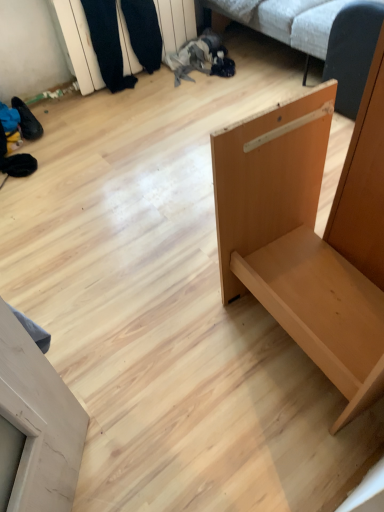
Describe the element at coordinates (299, 23) in the screenshot. The height and width of the screenshot is (512, 384). I see `white fabric couch at upper center` at that location.

Find the location of a particular element. This screenshot has width=384, height=512. light brown wood shelf at right, the 1th furniture from the right is located at coordinates (309, 234).

Image resolution: width=384 pixels, height=512 pixels. Describe the element at coordinates (309, 234) in the screenshot. I see `light brown wood shelf at right, the 1th furniture from the right` at that location.

Describe the element at coordinates (35, 426) in the screenshot. I see `light brown wood door at lower left, which is counted as the first furniture, starting from the left` at that location.

This screenshot has height=512, width=384. I want to click on light brown wood door at lower left, which is counted as the first furniture, starting from the left, so click(x=35, y=426).

Describe the element at coordinates (78, 44) in the screenshot. The image size is (384, 512). I see `wooden shelf at upper left` at that location.

At what (x,y) coordinates should I click in order to perform the action: click on white fabric couch at upper center. Please return your answer as a coordinate pair (x, y). The width and height of the screenshot is (384, 512). Looking at the image, I should click on (299, 23).

Choose the correct answer: Is light brown wood shelf at right, which is the 2th furniture from left to right, inside light brown wood door at lower left, which is counted as the first furniture, starting from the left, or outside it?

light brown wood shelf at right, which is the 2th furniture from left to right, is not enclosed by light brown wood door at lower left, which is counted as the first furniture, starting from the left.

Can you confirm if light brown wood shelf at right, which is the 2th furniture from left to right, is thinner than light brown wood door at lower left, acting as the 2th furniture starting from the right?

No.

Are light brown wood shelf at right, which is the 2th furniture from left to right, and light brown wood door at lower left, acting as the 2th furniture starting from the right, located far from each other?

That's not correct — light brown wood shelf at right, which is the 2th furniture from left to right, is a little close to light brown wood door at lower left, acting as the 2th furniture starting from the right.

Which point is more forward, (271, 12) or (75, 39)?

The point (75, 39) is closer to the camera.

Based on the photo, how many degrees apart are the facing directions of white fabric couch at upper center and wooden shelf at upper left?

The angular difference between white fabric couch at upper center and wooden shelf at upper left is 2.14 degrees.

Based on the photo, in the image, is white fabric couch at upper center positioned in front of or behind wooden shelf at upper left?

Clearly, white fabric couch at upper center is in front of wooden shelf at upper left.

Considering the sizes of objects white fabric couch at upper center and wooden shelf at upper left in the image provided, who is wider, white fabric couch at upper center or wooden shelf at upper left?

white fabric couch at upper center.

Where is `studio couch below the light brown wood door at lower left, which is counted as the first furniture, starting from the left (from a real-world perspective)`? The image size is (384, 512). studio couch below the light brown wood door at lower left, which is counted as the first furniture, starting from the left (from a real-world perspective) is located at coordinates (299, 23).

From the image's perspective, would you say light brown wood door at lower left, acting as the 2th furniture starting from the right, is positioned over white fabric couch at upper center?

No.

Is light brown wood door at lower left, acting as the 2th furniture starting from the right, closer to camera compared to white fabric couch at upper center?

Yes, it is.

Is light brown wood door at lower left, which is counted as the first furniture, starting from the left, facing towards white fabric couch at upper center?

Yes, light brown wood door at lower left, which is counted as the first furniture, starting from the left, is facing white fabric couch at upper center.

From a real-world perspective, is white fabric couch at upper center located beneath light brown wood shelf at right, which is the 2th furniture from left to right?

Yes, from a real-world perspective, white fabric couch at upper center is under light brown wood shelf at right, which is the 2th furniture from left to right.

Who is taller, white fabric couch at upper center or light brown wood shelf at right, which is the 2th furniture from left to right?

light brown wood shelf at right, which is the 2th furniture from left to right.

Can light brown wood shelf at right, the 1th furniture from the right, be found inside white fabric couch at upper center?

No, light brown wood shelf at right, the 1th furniture from the right, is not a part of white fabric couch at upper center.

Is wooden shelf at upper left not near light brown wood shelf at right, which is the 2th furniture from left to right?

Yes, wooden shelf at upper left is far from light brown wood shelf at right, which is the 2th furniture from left to right.

Is wooden shelf at upper left oriented away from light brown wood shelf at right, which is the 2th furniture from left to right?

No, light brown wood shelf at right, which is the 2th furniture from left to right, is not at the back of wooden shelf at upper left.

In order to click on shelf below the light brown wood shelf at right, which is the 2th furniture from left to right (from a real-world perspective) in this screenshot , I will do `click(78, 44)`.

From a real-world perspective, which object stands above the other?

light brown wood shelf at right, which is the 2th furniture from left to right, is physically above.

Which object is further away from the camera, light brown wood door at lower left, acting as the 2th furniture starting from the right, or light brown wood shelf at right, which is the 2th furniture from left to right?

Positioned behind is light brown wood shelf at right, which is the 2th furniture from left to right.

Is light brown wood door at lower left, which is counted as the first furniture, starting from the left, far from light brown wood shelf at right, which is the 2th furniture from left to right?

No, light brown wood door at lower left, which is counted as the first furniture, starting from the left, is not far away from light brown wood shelf at right, which is the 2th furniture from left to right.

Is light brown wood shelf at right, the 1th furniture from the right, a part of light brown wood door at lower left, acting as the 2th furniture starting from the right?

No.

From the image's perspective, which is above, light brown wood door at lower left, acting as the 2th furniture starting from the right, or light brown wood shelf at right, the 1th furniture from the right?

light brown wood shelf at right, the 1th furniture from the right.

Is light brown wood shelf at right, the 1th furniture from the right, oriented towards wooden shelf at upper left?

No, light brown wood shelf at right, the 1th furniture from the right, is not facing towards wooden shelf at upper left.

Would you say light brown wood shelf at right, which is the 2th furniture from left to right, is inside or outside wooden shelf at upper left?

light brown wood shelf at right, which is the 2th furniture from left to right, is spatially situated outside wooden shelf at upper left.

Between point (294, 105) and point (79, 77), which one is positioned behind?

The point (79, 77) is behind.

Between light brown wood shelf at right, the 1th furniture from the right, and wooden shelf at upper left, which one has more height?

With more height is light brown wood shelf at right, the 1th furniture from the right.

You are a GUI agent. You are given a task and a screenshot of the screen. Output one action in this format:
    pyautogui.click(x=<x>, y=<y>)
    Task: Click on the furniture that is above the light brown wood shelf at right, the 1th furniture from the right (from a real-world perspective)
    
    Given the screenshot: What is the action you would take?
    pyautogui.click(x=35, y=426)

The height and width of the screenshot is (512, 384). I want to click on shelf below the white fabric couch at upper center (from the image's perspective), so [x=78, y=44].

From the picture: Which object lies further to the anchor point white fabric couch at upper center, light brown wood door at lower left, acting as the 2th furniture starting from the right, or wooden shelf at upper left?

Among the two, light brown wood door at lower left, acting as the 2th furniture starting from the right, is located further to white fabric couch at upper center.

When comparing their distances from wooden shelf at upper left, does white fabric couch at upper center or light brown wood door at lower left, acting as the 2th furniture starting from the right, seem closer?

white fabric couch at upper center is positioned closer to the anchor wooden shelf at upper left.

Based on their spatial positions, is light brown wood door at lower left, which is counted as the first furniture, starting from the left, or light brown wood shelf at right, which is the 2th furniture from left to right, closer to wooden shelf at upper left?

light brown wood shelf at right, which is the 2th furniture from left to right.

From the picture: Estimate the real-world distances between objects in this image. Which object is closer to light brown wood door at lower left, acting as the 2th furniture starting from the right, light brown wood shelf at right, which is the 2th furniture from left to right, or white fabric couch at upper center?

Based on the image, light brown wood shelf at right, which is the 2th furniture from left to right, appears to be nearer to light brown wood door at lower left, acting as the 2th furniture starting from the right.

Looking at the image, which one is located closer to light brown wood door at lower left, which is counted as the first furniture, starting from the left, wooden shelf at upper left or white fabric couch at upper center?

Among the two, wooden shelf at upper left is located nearer to light brown wood door at lower left, which is counted as the first furniture, starting from the left.

Looking at the image, which one is located further to wooden shelf at upper left, white fabric couch at upper center or light brown wood shelf at right, which is the 2th furniture from left to right?

light brown wood shelf at right, which is the 2th furniture from left to right, is positioned further to the anchor wooden shelf at upper left.

Considering their positions, is wooden shelf at upper left positioned closer to white fabric couch at upper center than light brown wood shelf at right, the 1th furniture from the right?

wooden shelf at upper left lies closer to white fabric couch at upper center than the other object.

Consider the image. Which object lies further to the anchor point light brown wood shelf at right, the 1th furniture from the right, wooden shelf at upper left or light brown wood door at lower left, which is counted as the first furniture, starting from the left?

Based on the image, wooden shelf at upper left appears to be further to light brown wood shelf at right, the 1th furniture from the right.

Find the location of a particular element. furniture between wooden shelf at upper left and light brown wood door at lower left, which is counted as the first furniture, starting from the left, in the vertical direction is located at coordinates (309, 234).

You are a GUI agent. You are given a task and a screenshot of the screen. Output one action in this format:
    pyautogui.click(x=<x>, y=<y>)
    Task: Click on the furniture between white fabric couch at upper center and light brown wood door at lower left, which is counted as the first furniture, starting from the left, in the up-down direction
    This screenshot has width=384, height=512.
    Given the screenshot: What is the action you would take?
    pyautogui.click(x=309, y=234)

What are the coordinates of `shelf between white fabric couch at upper center and light brown wood door at lower left, which is counted as the first furniture, starting from the left, in the up-down direction` in the screenshot? It's located at (78, 44).

You are a GUI agent. You are given a task and a screenshot of the screen. Output one action in this format:
    pyautogui.click(x=<x>, y=<y>)
    Task: Click on the shelf that lies between white fabric couch at upper center and light brown wood shelf at right, the 1th furniture from the right, from top to bottom
    This screenshot has height=512, width=384.
    Given the screenshot: What is the action you would take?
    pyautogui.click(x=78, y=44)